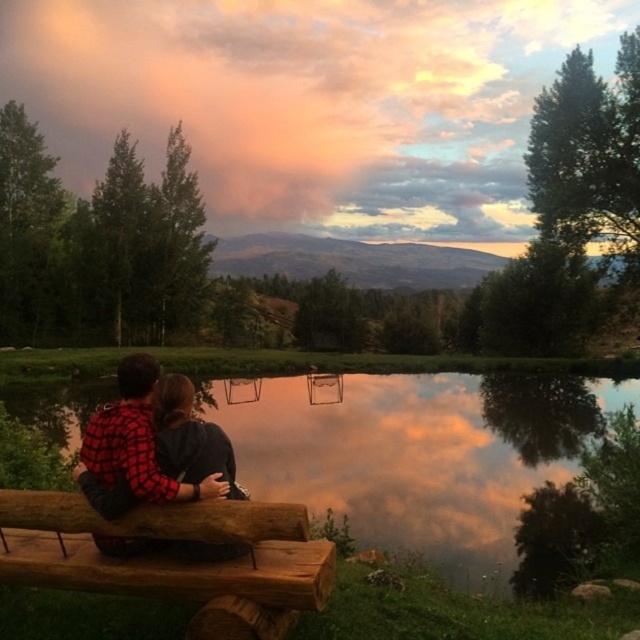
Is smooth reflective water at center below rustic wood bench at lower center?

Indeed, smooth reflective water at center is positioned under rustic wood bench at lower center.

Does point (353, 413) come behind point (237, 528)?

Yes, it is behind point (237, 528).

Does point (10, 401) come behind point (282, 506)?

Yes, point (10, 401) is behind point (282, 506).

In order to click on smooth reflective water at center in this screenshot , I will do `click(419, 456)`.

Does rustic wood bench at lower center appear over red plaid shirt at center?

No, rustic wood bench at lower center is not above red plaid shirt at center.

Between rustic wood bench at lower center and red plaid shirt at center, which one has more height?

rustic wood bench at lower center

The width and height of the screenshot is (640, 640). What do you see at coordinates (173, 557) in the screenshot? I see `rustic wood bench at lower center` at bounding box center [173, 557].

Find the location of a particular element. rustic wood bench at lower center is located at coordinates (173, 557).

Does smooth reflective water at center have a greater width compared to red plaid shirt at lower left?

Indeed, smooth reflective water at center has a greater width compared to red plaid shirt at lower left.

Which is above, smooth reflective water at center or red plaid shirt at lower left?

Positioned higher is red plaid shirt at lower left.

Where is `smooth reflective water at center`? Image resolution: width=640 pixels, height=640 pixels. smooth reflective water at center is located at coordinates (419, 456).